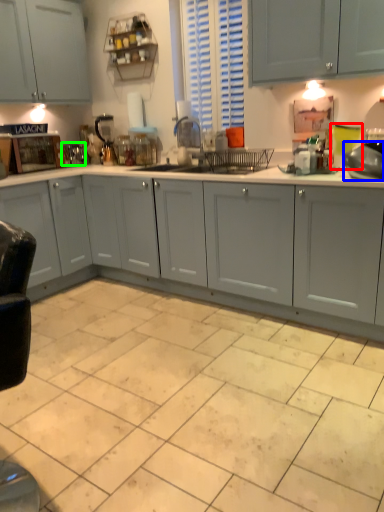
Question: Estimate the real-world distances between objects in this image. Which object is farther from teal (highlighted by a red box), appliance (highlighted by a blue box) or appliance (highlighted by a green box)?

Choices:
 (A) appliance
 (B) appliance

Answer: (B)